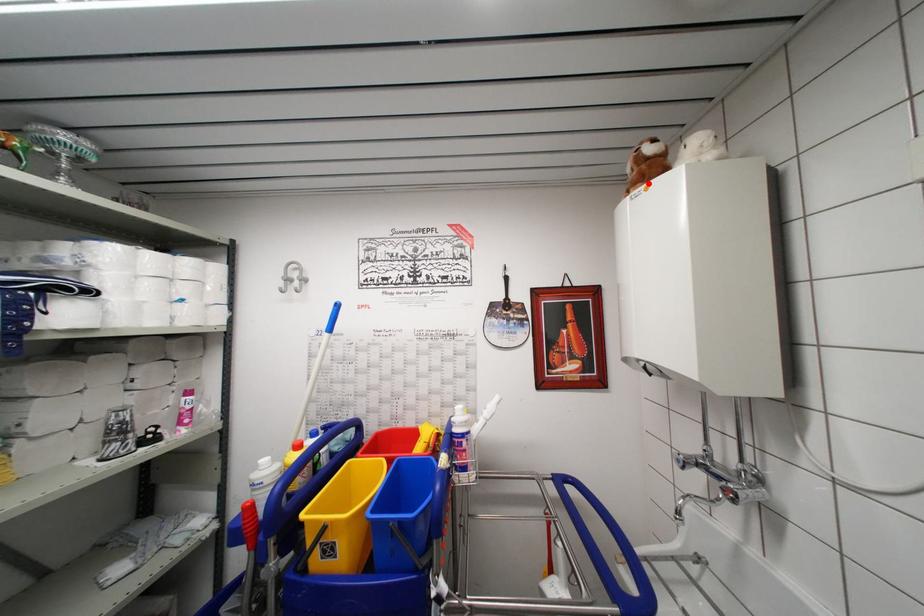
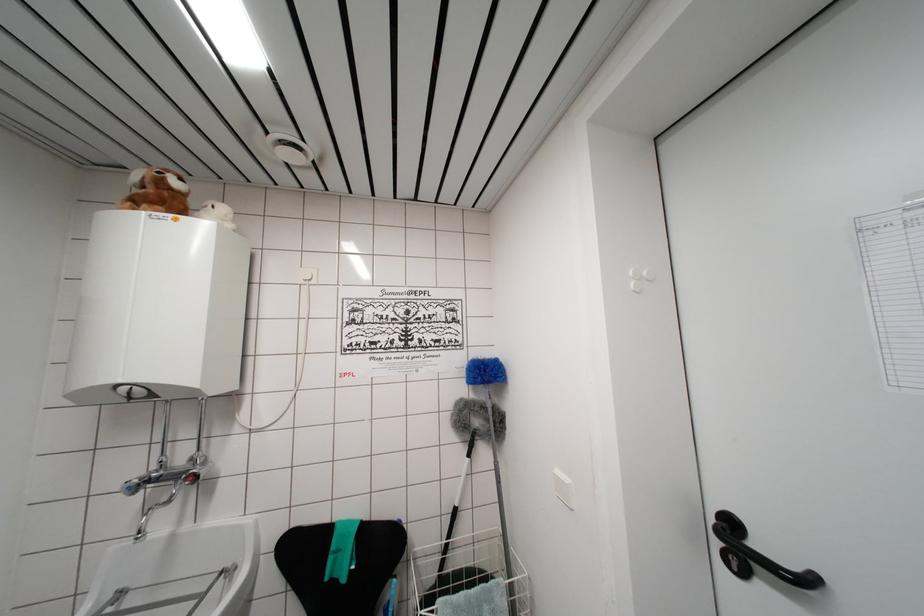
The point at the highlighted location is marked in the first image. Where is the corresponding point in the second image?

(168, 209)